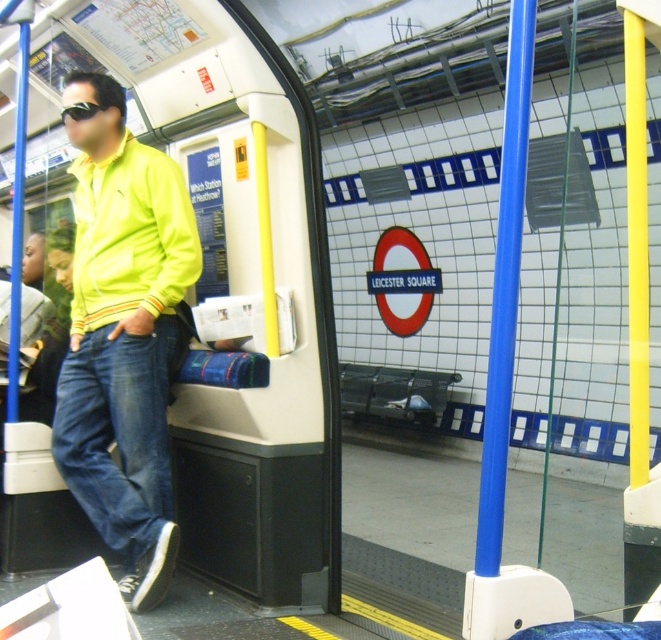
You are a passenger on the London Underground train at Leicester Square station. You notice two points marked on the platform through the open door. The first point is at coordinate point (x=67, y=420) and the second is at coordinate point (x=89, y=104). Which point is closer to you as you stand inside the train?

Point (x=67, y=420) is closer to you because it is further to the viewer than point (x=89, y=104).

You are a commuter on the train and want to check the platform sign. Which object, the denim at left or the black rubber goggles at upper left, would block your view of the platform sign outside the train door?

The denim at left is larger in size than the black rubber goggles at upper left, so the denim at left would block your view of the platform sign outside the train door.